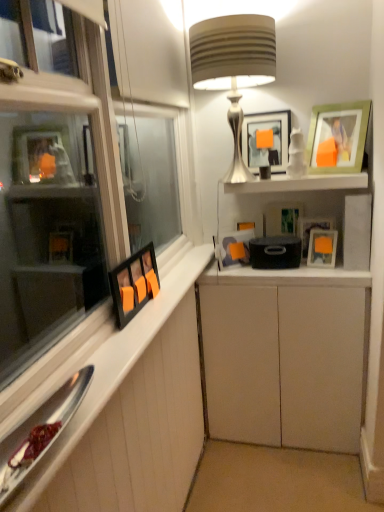
Question: In terms of size, does white matte cabinet at center, positioned as the first cabinetry in right-to-left order, appear bigger or smaller than matte black picture frame at upper right, which is the 2th picture frame in left-to-right order?

Choices:
 (A) big
 (B) small

Answer: (A)

Question: Considering their positions, is white matte cabinet at center, the 2th cabinetry in the left-to-right sequence, located in front of or behind matte black picture frame at upper right, which is counted as the 6th picture frame, starting from the right?

Choices:
 (A) front
 (B) behind

Answer: (A)

Question: Which of these objects is positioned farthest from the matte black picture frame at center, which is the 4th picture frame from left to right?

Choices:
 (A) green matte picture frame at upper right, the seventh picture frame positioned from the left
 (B) white wood cabinet at left, placed as the 1th cabinetry when sorted from left to right
 (C) matte black picture frame at upper right, the sixth picture frame when ordered from left to right
 (D) satin silver lamp at upper center
 (E) white matte cabinet at center, the 2th cabinetry in the left-to-right sequence

Answer: (B)

Question: Based on their relative distances, which object is nearer to the white matte cabinet at center, the 2th cabinetry in the left-to-right sequence?

Choices:
 (A) matte black picture frame at upper right, which is the 2th picture frame in left-to-right order
 (B) matte black picture frame at upper center, the 5th picture frame from the right
 (C) white glossy picture frame at center-right, the 3th picture frame when ordered from right to left
 (D) matte black picture frame at upper right, the sixth picture frame when ordered from left to right
 (E) matte black picture frame at center, the fourth picture frame in the right-to-left sequence

Answer: (A)